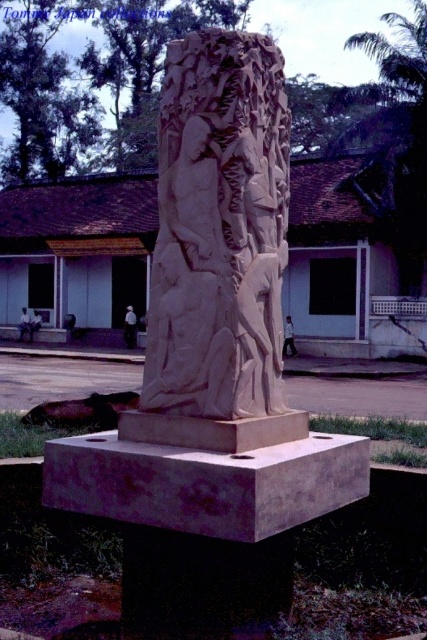
Does sandstone sculpture at center have a larger size compared to sandstone carving at center?

No, sandstone sculpture at center is not bigger than sandstone carving at center.

Between sandstone sculpture at center and sandstone carving at center, which one has less height?

sandstone carving at center

Identify the location of sandstone sculpture at center. (213, 365).

Does sandstone sculpture at center have a larger size compared to smooth stone sculpture at center?

Incorrect, sandstone sculpture at center is not larger than smooth stone sculpture at center.

Which of these two, sandstone sculpture at center or smooth stone sculpture at center, stands taller?

Standing taller between the two is sandstone sculpture at center.

The width and height of the screenshot is (427, 640). Identify the location of sandstone sculpture at center. (213, 365).

Where is `sandstone sculpture at center`? sandstone sculpture at center is located at coordinates (213, 365).

Between point (251, 68) and point (116, 442), which one is positioned in front?

Point (251, 68)

Who is positioned more to the left, sandstone carving at center or smooth stone sculpture at center?

sandstone carving at center

Between point (248, 300) and point (46, 483), which one is positioned in front?

Point (248, 300) is more forward.

Identify the location of sandstone carving at center. (x=219, y=228).